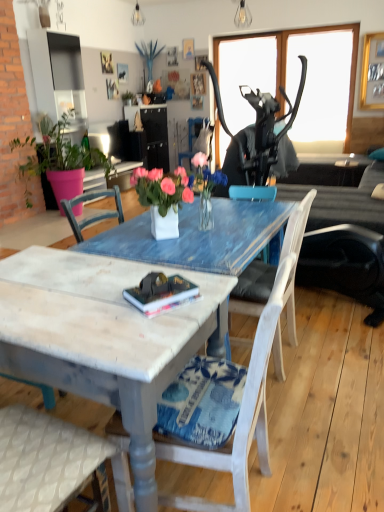
Question: Can you confirm if matte blue vase at upper center is smaller than hardcover book at center?

Choices:
 (A) no
 (B) yes

Answer: (A)

Question: Can you confirm if matte blue vase at upper center is positioned to the right of hardcover book at center?

Choices:
 (A) no
 (B) yes

Answer: (A)

Question: Is hardcover book at center completely or partially inside matte blue vase at upper center?

Choices:
 (A) yes
 (B) no

Answer: (B)

Question: Is matte blue vase at upper center at the left side of hardcover book at center?

Choices:
 (A) no
 (B) yes

Answer: (B)

Question: Can you confirm if matte blue vase at upper center is wider than hardcover book at center?

Choices:
 (A) no
 (B) yes

Answer: (B)

Question: From a real-world perspective, is matte blue vase at upper center physically below hardcover book at center?

Choices:
 (A) no
 (B) yes

Answer: (A)

Question: Is the depth of hardcover book at center greater than that of matte blue vase at upper center?

Choices:
 (A) no
 (B) yes

Answer: (A)

Question: Can you confirm if hardcover book at center is positioned to the right of matte blue vase at upper center?

Choices:
 (A) yes
 (B) no

Answer: (A)

Question: Is matte blue vase at upper center surrounded by hardcover book at center?

Choices:
 (A) no
 (B) yes

Answer: (A)

Question: Is hardcover book at center not inside matte blue vase at upper center?

Choices:
 (A) no
 (B) yes

Answer: (B)

Question: Is hardcover book at center positioned far away from matte blue vase at upper center?

Choices:
 (A) no
 (B) yes

Answer: (B)

Question: From a real-world perspective, is hardcover book at center positioned under matte blue vase at upper center based on gravity?

Choices:
 (A) yes
 (B) no

Answer: (A)

Question: Does matte black lampshade at upper center, acting as the 1th lamp starting from the top, turn towards white painted wood chair at center, the 1th chair viewed from the front?

Choices:
 (A) yes
 (B) no

Answer: (B)